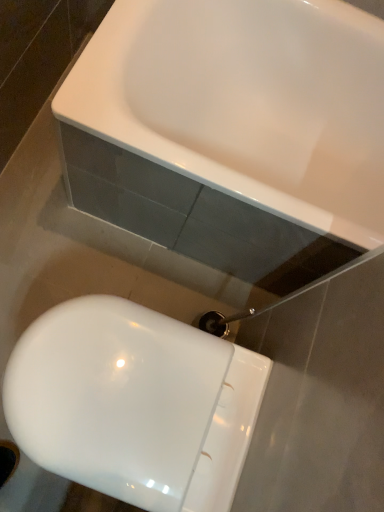
Locate an element on the screen. vacant area on top of white glossy toilet at lower left (from a real-world perspective) is located at coordinates (123, 391).